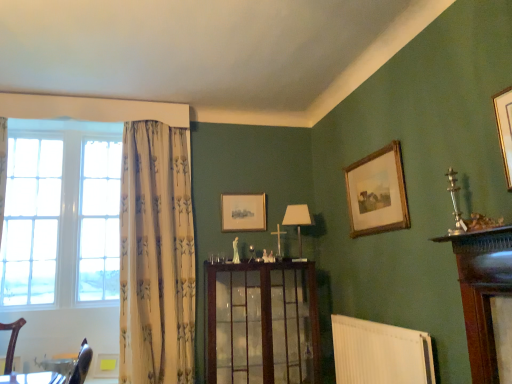
This screenshot has height=384, width=512. What are the coordinates of `white floral fabric curtain at left` in the screenshot? It's located at (156, 256).

The image size is (512, 384). What do you see at coordinates (298, 220) in the screenshot?
I see `white fabric lampshade at center` at bounding box center [298, 220].

Identify the location of matte wooden picture frame at center, acting as the second picture frame starting from the front. (243, 212).

Which object is closer to the camera, white ribbed radiator at lower center or wooden cabinet at center?

white ribbed radiator at lower center is more forward.

Considering the relative sizes of white ribbed radiator at lower center and wooden cabinet at center in the image provided, is white ribbed radiator at lower center shorter than wooden cabinet at center?

Yes, white ribbed radiator at lower center is shorter than wooden cabinet at center.

In terms of size, does white ribbed radiator at lower center appear bigger or smaller than wooden cabinet at center?

Considering their sizes, white ribbed radiator at lower center takes up less space than wooden cabinet at center.

Would you say wooden cabinet at center is part of white ribbed radiator at lower center's contents?

No, wooden cabinet at center is located outside of white ribbed radiator at lower center.

Does point (67, 139) come in front of point (225, 212)?

That is False.

Identify the location of window below the matte wooden picture frame at center, positioned as the 1th picture frame in left-to-right order (from the image's perspective). (61, 215).

From a real-world perspective, is white glass window at left physically below matte wooden picture frame at center, which is counted as the second picture frame, starting from the right?

Yes, from a real-world perspective, white glass window at left is under matte wooden picture frame at center, which is counted as the second picture frame, starting from the right.

Considering the relative positions of white glass window at left and matte wooden picture frame at center, the 1th picture frame positioned from the back, in the image provided, is white glass window at left to the right of matte wooden picture frame at center, the 1th picture frame positioned from the back, from the viewer's perspective?

No.

How distant is wooden cabinet at center from white glass window at left?

wooden cabinet at center and white glass window at left are 1.36 meters apart from each other.

Is wooden cabinet at center far away from white glass window at left?

wooden cabinet at center is far away from white glass window at left.

Does wooden cabinet at center turn towards white glass window at left?

No, wooden cabinet at center does not turn towards white glass window at left.

Can you confirm if wooden cabinet at center is positioned to the right of white glass window at left?

Correct, you'll find wooden cabinet at center to the right of white glass window at left.

Is white ribbed radiator at lower center turned away from matte wooden picture frame at center, acting as the second picture frame starting from the front?

No, white ribbed radiator at lower center is not facing away from matte wooden picture frame at center, acting as the second picture frame starting from the front.

Based on the photo, considering the sizes of objects white ribbed radiator at lower center and matte wooden picture frame at center, which is counted as the second picture frame, starting from the right, in the image provided, who is bigger, white ribbed radiator at lower center or matte wooden picture frame at center, which is counted as the second picture frame, starting from the right,?

white ribbed radiator at lower center is bigger.

At what (x,y) coordinates should I click in order to perform the action: click on radiator on the right of the matte wooden picture frame at center, the 1th picture frame positioned from the back. Please return your answer as a coordinate pair (x, y). Looking at the image, I should click on (380, 353).

Can you see white ribbed radiator at lower center touching matte wooden picture frame at center, acting as the second picture frame starting from the front?

No, white ribbed radiator at lower center is not in contact with matte wooden picture frame at center, acting as the second picture frame starting from the front.

From a real-world perspective, who is located higher, white glass window at left or white ribbed radiator at lower center?

From a 3D spatial view, white glass window at left is above.

Which is correct: white glass window at left is inside white ribbed radiator at lower center, or outside of it?

white glass window at left lies outside white ribbed radiator at lower center.

In terms of width, does white glass window at left look wider or thinner when compared to white ribbed radiator at lower center?

white glass window at left is wider than white ribbed radiator at lower center.

Is white glass window at left in contact with white ribbed radiator at lower center?

No.

Considering the relative sizes of white ribbed radiator at lower center and wooden picture frame at upper right, the 2th picture frame from the back, in the image provided, is white ribbed radiator at lower center shorter than wooden picture frame at upper right, the 2th picture frame from the back,?

Incorrect, the height of white ribbed radiator at lower center does not fall short of that of wooden picture frame at upper right, the 2th picture frame from the back.

Is wooden picture frame at upper right, acting as the 1th picture frame starting from the right, at the back of white ribbed radiator at lower center?

No, wooden picture frame at upper right, acting as the 1th picture frame starting from the right, is not at the back of white ribbed radiator at lower center.

In order to click on curtain lying on the left of white ribbed radiator at lower center in this screenshot , I will do `click(156, 256)`.

From the image's perspective, would you say white ribbed radiator at lower center is shown under white floral fabric curtain at left?

Indeed, from the image's perspective, white ribbed radiator at lower center is shown beneath white floral fabric curtain at left.

Between point (408, 363) and point (156, 325), which one is positioned behind?

The point (156, 325) is behind.

Between white ribbed radiator at lower center and white floral fabric curtain at left, which one is positioned behind?

white floral fabric curtain at left is behind.

Image resolution: width=512 pixels, height=384 pixels. Find the location of `dresser behind the white ribbed radiator at lower center`. dresser behind the white ribbed radiator at lower center is located at coordinates (262, 322).

At what (x,y) coordinates should I click in order to perform the action: click on window below the matte wooden picture frame at center, which is counted as the second picture frame, starting from the right (from a real-world perspective). Please return your answer as a coordinate pair (x, y). Looking at the image, I should click on (61, 215).

Based on their spatial positions, is white floral fabric curtain at left or white fabric lampshade at center further from matte wooden picture frame at center, the 1th picture frame positioned from the back?

white floral fabric curtain at left.

When comparing their distances from white glass window at left, does white floral fabric curtain at left or matte wooden picture frame at center, acting as the second picture frame starting from the front, seem further?

matte wooden picture frame at center, acting as the second picture frame starting from the front, is further to white glass window at left.

Looking at the image, which one is located closer to white ribbed radiator at lower center, white floral fabric curtain at left or wooden cabinet at center?

Based on the image, wooden cabinet at center appears to be nearer to white ribbed radiator at lower center.

From the image, which object appears to be nearer to wooden cabinet at center, white ribbed radiator at lower center or white glass window at left?

Based on the image, white ribbed radiator at lower center appears to be nearer to wooden cabinet at center.

Considering their positions, is white ribbed radiator at lower center positioned further to wooden picture frame at upper right, acting as the 1th picture frame starting from the right, than white fabric lampshade at center?

Based on the image, white ribbed radiator at lower center appears to be further to wooden picture frame at upper right, acting as the 1th picture frame starting from the right.

From the image, which object appears to be nearer to white floral fabric curtain at left, white fabric lampshade at center or white glass window at left?

Among the two, white glass window at left is located nearer to white floral fabric curtain at left.

Estimate the real-world distances between objects in this image. Which object is further from white floral fabric curtain at left, wooden picture frame at upper right, the 2th picture frame from the back, or white fabric lampshade at center?

The object further to white floral fabric curtain at left is wooden picture frame at upper right, the 2th picture frame from the back.

Which object lies nearer to the anchor point white glass window at left, white floral fabric curtain at left or wooden picture frame at upper right, the 2th picture frame from the back?

Among the two, white floral fabric curtain at left is located nearer to white glass window at left.

Locate an element on the screen. picture frame between white glass window at left and white ribbed radiator at lower center in the horizontal direction is located at coordinates (243, 212).

Where is `lamp between white glass window at left and wooden picture frame at upper right, acting as the 1th picture frame starting from the right, from left to right`? This screenshot has width=512, height=384. lamp between white glass window at left and wooden picture frame at upper right, acting as the 1th picture frame starting from the right, from left to right is located at coordinates (298, 220).

Identify the location of picture frame between white glass window at left and white fabric lampshade at center from left to right. (243, 212).

Where is `radiator between white glass window at left and wooden picture frame at upper right, the 2th picture frame from the back, from left to right`? radiator between white glass window at left and wooden picture frame at upper right, the 2th picture frame from the back, from left to right is located at coordinates (380, 353).